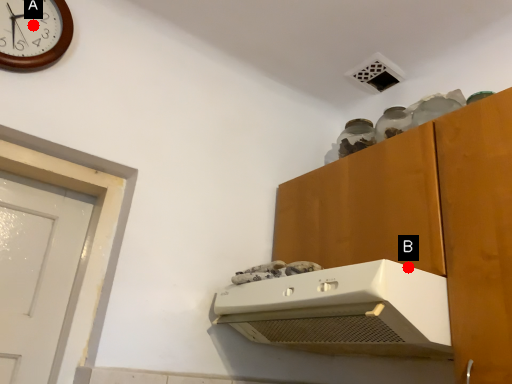
Question: Two points are circled on the image, labeled by A and B beside each circle. Which point is closer to the camera taking this photo?

Choices:
 (A) A is closer
 (B) B is closer

Answer: (B)